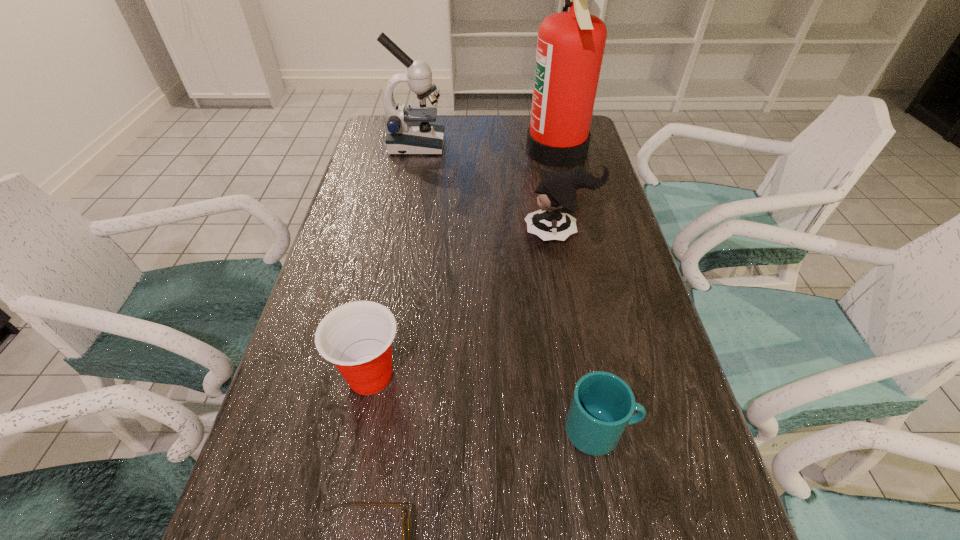
The height and width of the screenshot is (540, 960). Identify the location of free spot between the doll and the fifth tallest object. (580, 332).

This screenshot has width=960, height=540. In order to click on blank region between the second tallest object and the fire extinguisher in this screenshot , I will do `click(487, 148)`.

Identify the location of vacant space in between the third farthest object and the second shortest object. (580, 332).

Where is `free spot between the fire extinguisher and the second tallest object`? The image size is (960, 540). free spot between the fire extinguisher and the second tallest object is located at coordinates (487, 148).

Where is `free space between the taller cup and the right cup`? This screenshot has width=960, height=540. free space between the taller cup and the right cup is located at coordinates (486, 403).

At what (x,y) coordinates should I click in order to perform the action: click on vacant point located between the fifth shortest object and the fire extinguisher. Please return your answer as a coordinate pair (x, y). This screenshot has height=540, width=960. Looking at the image, I should click on (487, 148).

Image resolution: width=960 pixels, height=540 pixels. In order to click on object that is the closest one to the taller cup in this screenshot , I will do `click(405, 515)`.

Select which object appears as the fourth closest to the third farthest object. Please provide its 2D coordinates. Your answer should be formatted as a tuple, i.e. [(x, y)], where the tuple contains the x and y coordinates of a point satisfying the conditions above.

[(602, 405)]